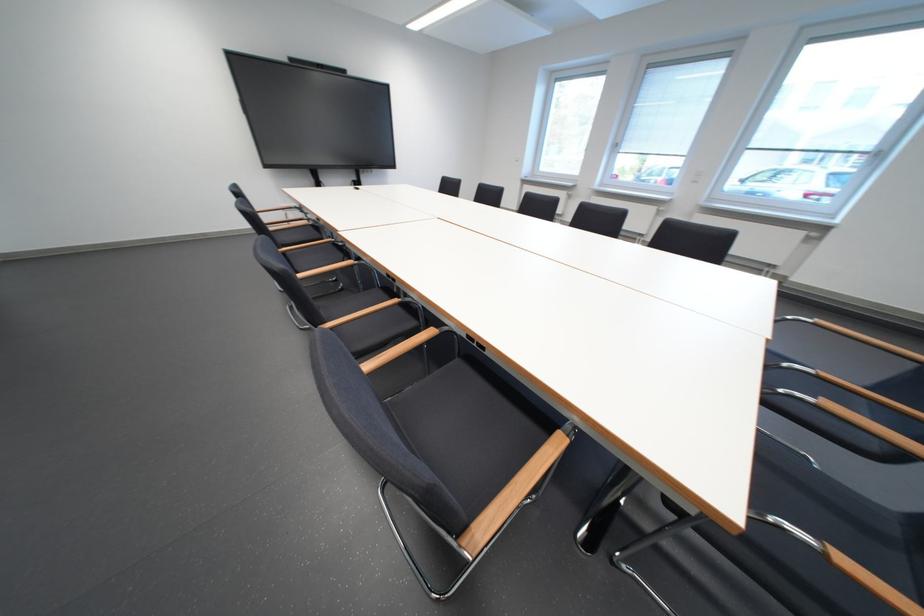
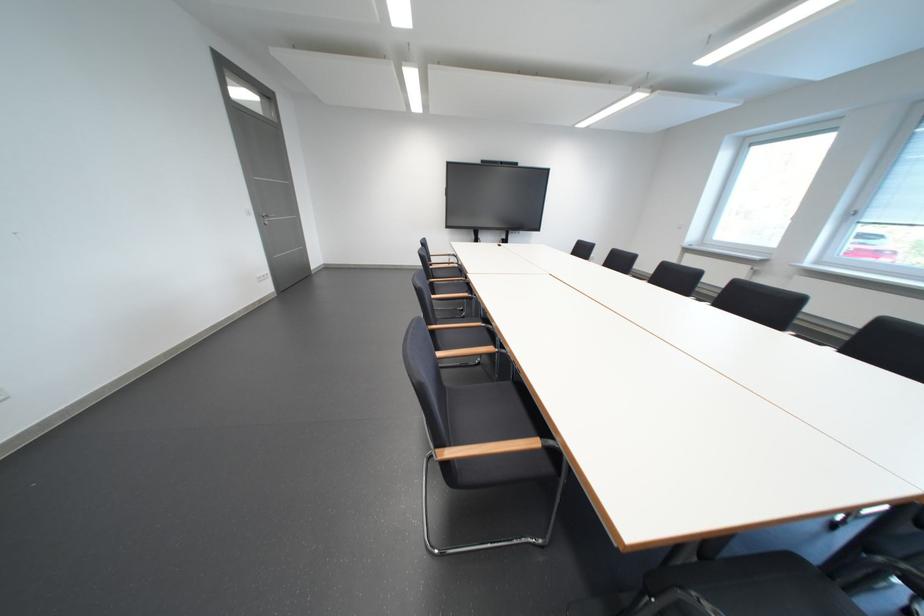
The point at (572,442) is marked in the first image. Where is the corresponding point in the second image?

(548, 445)